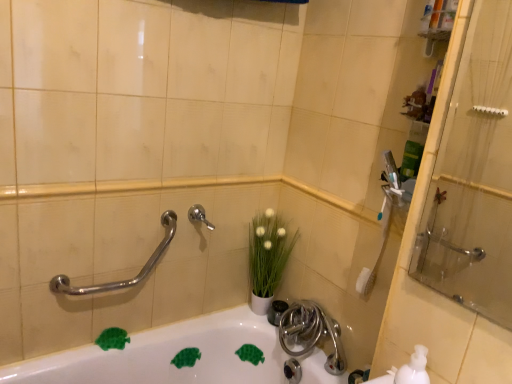
What do you see at coordinates (199, 215) in the screenshot? This screenshot has height=384, width=512. I see `satin nickel faucet at center` at bounding box center [199, 215].

The width and height of the screenshot is (512, 384). What do you see at coordinates (474, 177) in the screenshot?
I see `transparent glass shower door at right` at bounding box center [474, 177].

Image resolution: width=512 pixels, height=384 pixels. Identify the location of white glossy bathtub at lower center. (168, 355).

Is satin nickel faucet at lower center in front of or behind transparent glass shower door at right in the image?

satin nickel faucet at lower center is positioned farther from the viewer than transparent glass shower door at right.

Which object is positioned more to the right, satin nickel faucet at lower center or transparent glass shower door at right?

transparent glass shower door at right is more to the right.

Is transparent glass shower door at right completely or partially inside satin nickel faucet at lower center?

No, transparent glass shower door at right is not surrounded by satin nickel faucet at lower center.

From a real-world perspective, is satin nickel faucet at lower center below transparent glass shower door at right?

Yes.

Between satin nickel faucet at lower center and white glossy bathtub at lower center, which one has less height?

satin nickel faucet at lower center.

I want to click on bathtub in front of the satin nickel faucet at lower center, so click(x=168, y=355).

In the scene shown: Which of these two, satin nickel faucet at lower center or white glossy bathtub at lower center, is thinner?

satin nickel faucet at lower center is thinner.

Is satin nickel faucet at lower center oriented towards white glossy bathtub at lower center?

No, satin nickel faucet at lower center is not oriented towards white glossy bathtub at lower center.

Is transparent glass shower door at right further to the viewer compared to satin nickel faucet at lower center?

No, transparent glass shower door at right is closer to the viewer.

Are transparent glass shower door at right and satin nickel faucet at lower center located far from each other?

No, transparent glass shower door at right is in close proximity to satin nickel faucet at lower center.

You are a GUI agent. You are given a task and a screenshot of the screen. Output one action in this format:
    pyautogui.click(x=<x>, y=<y>)
    Task: Click on the tap behind the transparent glass shower door at right
    This screenshot has width=512, height=384.
    Given the screenshot: What is the action you would take?
    (x=311, y=333)

Is transparent glass shower door at right not within satin nickel faucet at lower center?

transparent glass shower door at right lies outside satin nickel faucet at lower center's area.

Is satin nickel faucet at center placed right next to white matte soap dispenser at lower right?

No, satin nickel faucet at center is not touching white matte soap dispenser at lower right.

Considering the positions of objects satin nickel faucet at center and white matte soap dispenser at lower right in the image provided, who is in front, satin nickel faucet at center or white matte soap dispenser at lower right?

white matte soap dispenser at lower right is closer to the camera.

From a real-world perspective, which object stands above the other?

satin nickel faucet at center, from a real-world perspective.

Which is farther, (193,218) or (362,383)?

Positioned behind is point (193,218).

Is white matte soap dispenser at lower right located within satin nickel faucet at lower center?

No, white matte soap dispenser at lower right is not a part of satin nickel faucet at lower center.

Measure the distance between satin nickel faucet at lower center and white matte soap dispenser at lower right.

The distance of satin nickel faucet at lower center from white matte soap dispenser at lower right is 21.83 inches.

Who is more distant, satin nickel faucet at lower center or white matte soap dispenser at lower right?

Positioned behind is satin nickel faucet at lower center.

Is transparent glass shower door at right positioned beyond the bounds of satin nickel faucet at center?

Yes, transparent glass shower door at right is located beyond the bounds of satin nickel faucet at center.

Does transparent glass shower door at right lie in front of satin nickel faucet at center?

Yes, it is.

Which of these two, transparent glass shower door at right or satin nickel faucet at center, stands taller?

With more height is transparent glass shower door at right.

Which object is wider, transparent glass shower door at right or satin nickel faucet at center?

satin nickel faucet at center is wider.

Image resolution: width=512 pixels, height=384 pixels. What are the coordinates of `shower lying in front of the satin nickel faucet at lower center` in the screenshot? It's located at click(x=124, y=280).

Based on the photo, is polished chrome grab bar at upper left looking in the opposite direction of satin nickel faucet at lower center?

No.

From the image's perspective, which is below, polished chrome grab bar at upper left or satin nickel faucet at lower center?

satin nickel faucet at lower center appears lower in the image.

Find the location of a particular element. shower door that is in front of the satin nickel faucet at lower center is located at coordinates (474, 177).

Image resolution: width=512 pixels, height=384 pixels. Find the location of `tap that is on the right side of white glossy bathtub at lower center`. tap that is on the right side of white glossy bathtub at lower center is located at coordinates (311, 333).

Which object lies further to the anchor point white matte soap dispenser at lower right, satin nickel faucet at center or satin nickel faucet at lower center?

satin nickel faucet at center lies further to white matte soap dispenser at lower right than the other object.

When comparing their distances from transparent glass shower door at right, does polished chrome grab bar at upper left or white matte vase at center seem further?

polished chrome grab bar at upper left.

Considering their positions, is transparent glass shower door at right positioned closer to white matte vase at center than white glossy bathtub at lower center?

Based on the image, white glossy bathtub at lower center appears to be nearer to white matte vase at center.

From the image, which object appears to be nearer to white matte soap dispenser at lower right, satin nickel faucet at center or polished chrome grab bar at upper left?

satin nickel faucet at center.

Estimate the real-world distances between objects in this image. Which object is closer to white matte soap dispenser at lower right, satin nickel faucet at lower center or white glossy bathtub at lower center?

satin nickel faucet at lower center is positioned closer to the anchor white matte soap dispenser at lower right.

Looking at the image, which one is located closer to white glossy bathtub at lower center, polished chrome grab bar at upper left or transparent glass shower door at right?

Among the two, polished chrome grab bar at upper left is located nearer to white glossy bathtub at lower center.

Which object lies further to the anchor point white matte vase at center, transparent glass shower door at right or satin nickel faucet at center?

Among the two, transparent glass shower door at right is located further to white matte vase at center.

Which object lies further to the anchor point satin nickel faucet at lower center, satin nickel faucet at center or polished chrome grab bar at upper left?

polished chrome grab bar at upper left is further to satin nickel faucet at lower center.

You are a GUI agent. You are given a task and a screenshot of the screen. Output one action in this format:
    pyautogui.click(x=<x>, y=<y>)
    Task: Click on the plumbing fixture situated between polished chrome grab bar at upper left and white matte vase at center from left to right
    
    Given the screenshot: What is the action you would take?
    pyautogui.click(x=199, y=215)

You are a GUI agent. You are given a task and a screenshot of the screen. Output one action in this format:
    pyautogui.click(x=<x>, y=<y>)
    Task: Click on the flower that lies between satin nickel faucet at center and satin nickel faucet at lower center from top to bottom
    Image resolution: width=512 pixels, height=384 pixels.
    Given the screenshot: What is the action you would take?
    pyautogui.click(x=268, y=252)

Where is `plumbing fixture located between transparent glass shower door at right and white matte vase at center in the depth direction`? The width and height of the screenshot is (512, 384). plumbing fixture located between transparent glass shower door at right and white matte vase at center in the depth direction is located at coordinates (199, 215).

The width and height of the screenshot is (512, 384). In order to click on sink between transparent glass shower door at right and white glossy bathtub at lower center in the vertical direction in this screenshot , I will do `click(407, 370)`.